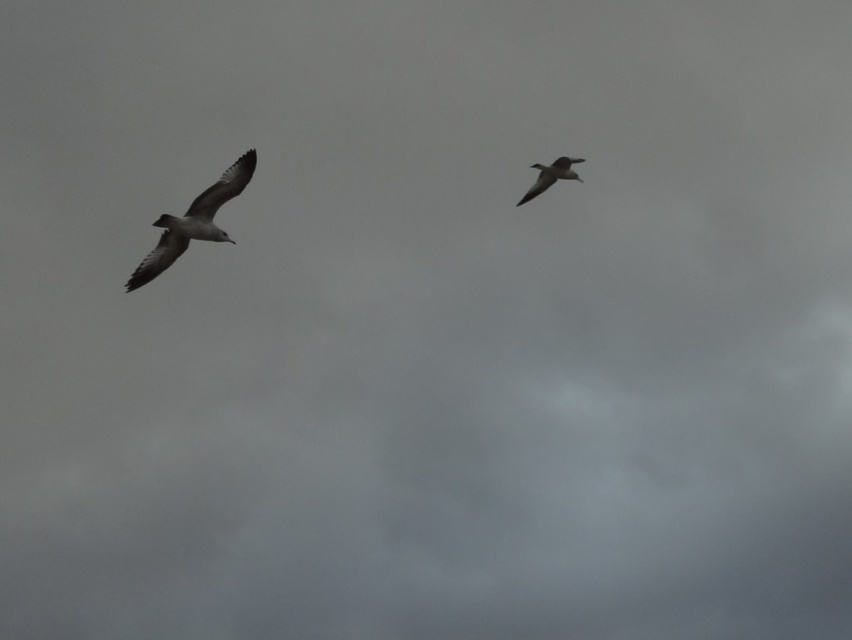
You are a birdwatcher observing the two birds in the cloudy sky. Which bird, the white feathered bird at left or the gray feathered bird at upper right, appears taller in the sky?

The white feathered bird at left appears taller than the gray feathered bird at upper right.

You are a birdwatcher trying to capture both the white feathered bird at left and the gray feathered bird at upper right in a single photo. Given that your camera has a 5 meter range, can you fit both birds in the frame?

The distance between the white feathered bird at left and the gray feathered bird at upper right is 6.89 meters. Since your camera has a 5 meter range, you cannot fit both birds in the frame as the distance exceeds the camera range.

You are observing two points in the image of birds flying in a cloudy sky. Which point, point (171, 234) or point (540, 180), is nearer to your viewpoint?

Point (171, 234) is closer to the camera than point (540, 180).